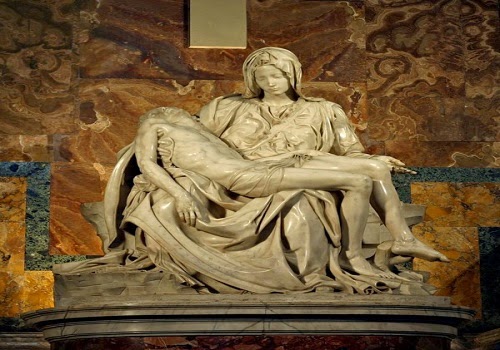
Where is `statue feet`? statue feet is located at coordinates (409, 251), (368, 273).